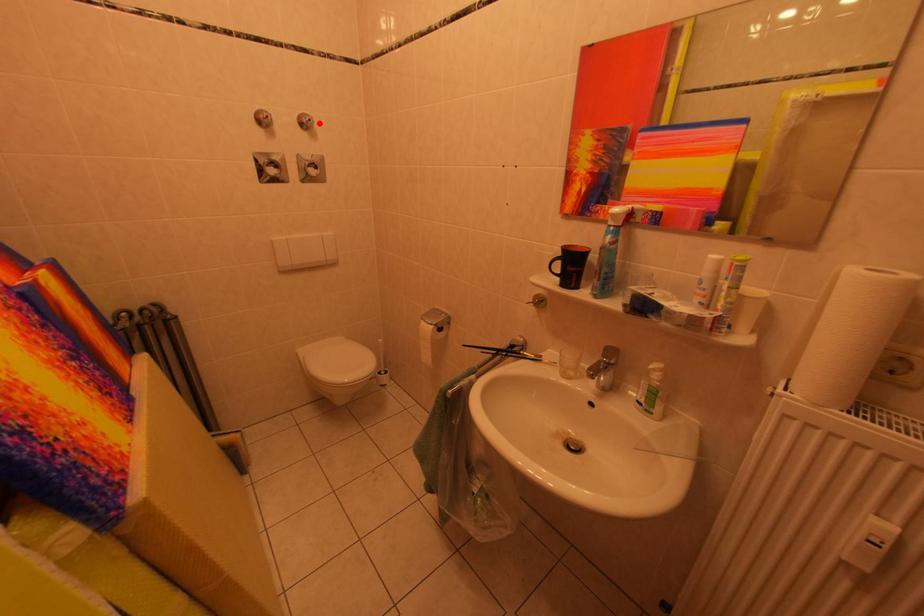
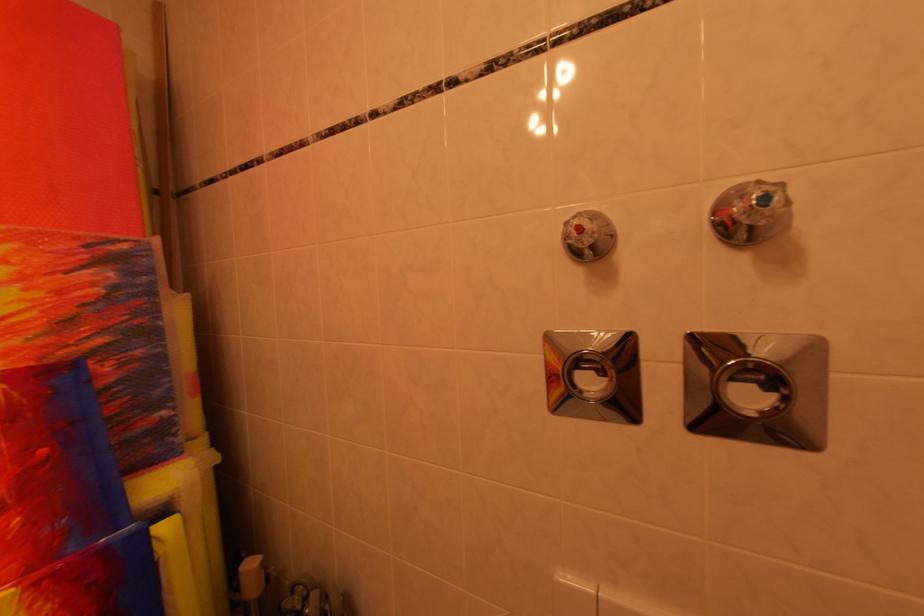
The point at the highlighted location is marked in the first image. Where is the corresponding point in the second image?

(773, 201)